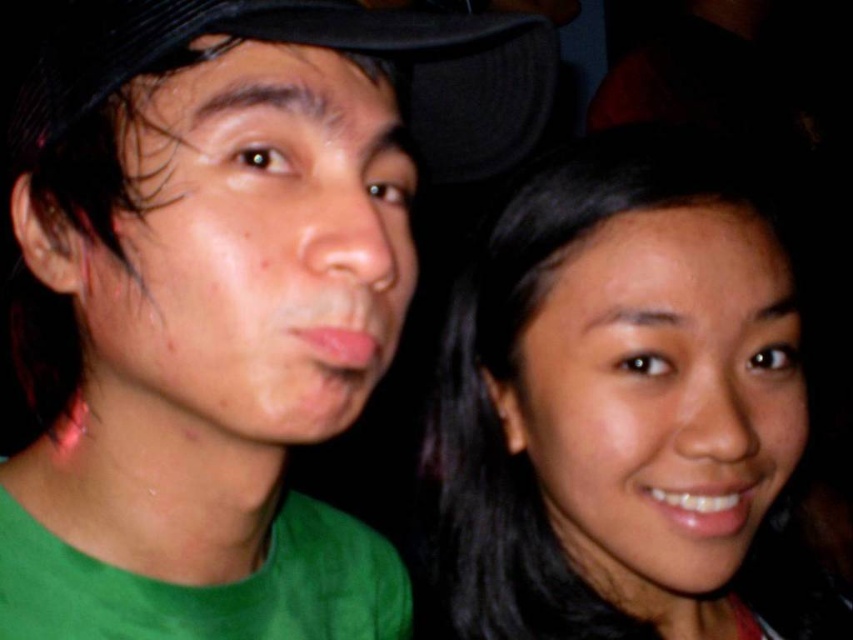
Can you confirm if green matte shirt at left is bigger than black fabric cap at upper center?

Indeed, green matte shirt at left has a larger size compared to black fabric cap at upper center.

Between green matte shirt at left and black fabric cap at upper center, which one appears on the left side from the viewer's perspective?

green matte shirt at left is more to the left.

The height and width of the screenshot is (640, 853). Describe the element at coordinates (227, 300) in the screenshot. I see `green matte shirt at left` at that location.

The width and height of the screenshot is (853, 640). I want to click on green matte shirt at left, so click(x=227, y=300).

Does green matte shirt at left have a greater height compared to smooth skin face at right?

No.

Between green matte shirt at left and smooth skin face at right, which one has less height?

green matte shirt at left

Which is in front, point (202, 349) or point (695, 244)?

Point (202, 349) is in front.

Locate an element on the screen. green matte shirt at left is located at coordinates (227, 300).

Is smooth skin face at right positioned before black fabric cap at upper center?

No.

At what (x,y) coordinates should I click in order to perform the action: click on smooth skin face at right. Please return your answer as a coordinate pair (x, y). Looking at the image, I should click on pyautogui.click(x=618, y=400).

The height and width of the screenshot is (640, 853). I want to click on smooth skin face at right, so click(618, 400).